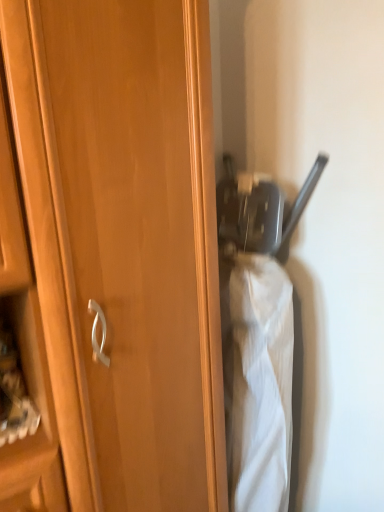
Question: Is matte black umbrella at center inside the boundaries of wooden cupboard at center, or outside?

Choices:
 (A) inside
 (B) outside

Answer: (B)

Question: In the image, is matte black umbrella at center positioned in front of or behind wooden cupboard at center?

Choices:
 (A) behind
 (B) front

Answer: (A)

Question: Is matte black umbrella at center taller or shorter than wooden cupboard at center?

Choices:
 (A) tall
 (B) short

Answer: (B)

Question: In terms of width, does wooden cupboard at center look wider or thinner when compared to matte black umbrella at center?

Choices:
 (A) wide
 (B) thin

Answer: (B)

Question: Considering their positions, is wooden cupboard at center located in front of or behind matte black umbrella at center?

Choices:
 (A) behind
 (B) front

Answer: (B)

Question: From the image's perspective, is wooden cupboard at center above or below matte black umbrella at center?

Choices:
 (A) below
 (B) above

Answer: (B)

Question: Visually, is wooden cupboard at center positioned to the left or to the right of matte black umbrella at center?

Choices:
 (A) left
 (B) right

Answer: (A)